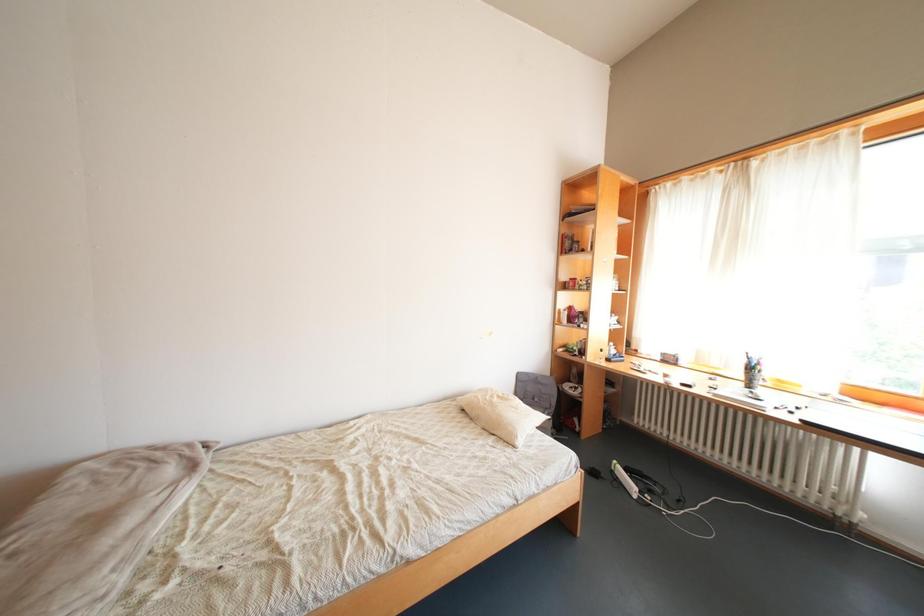
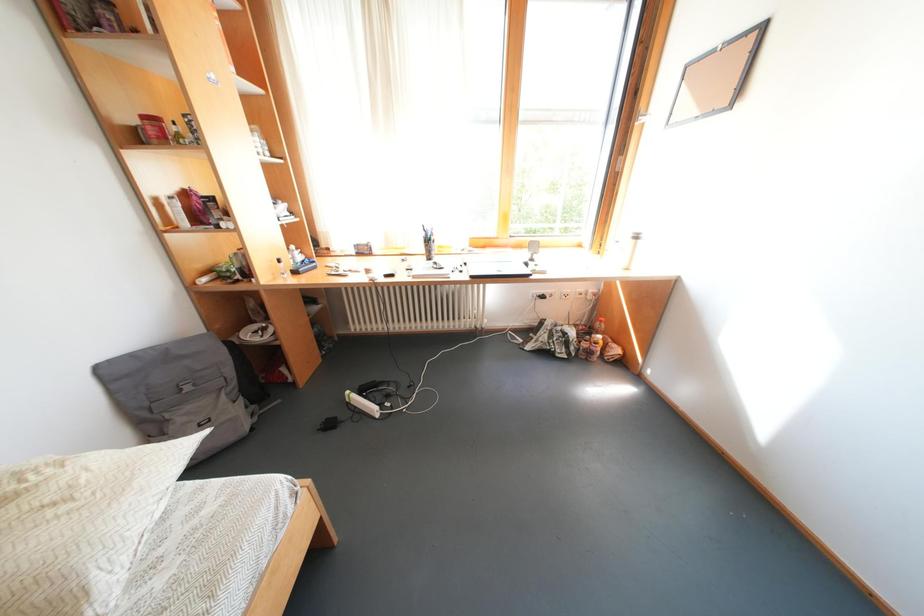
The first image is from the beginning of the video and the second image is from the end. How did the camera likely rotate when shooting the video?

The camera's rotation is toward right-down.